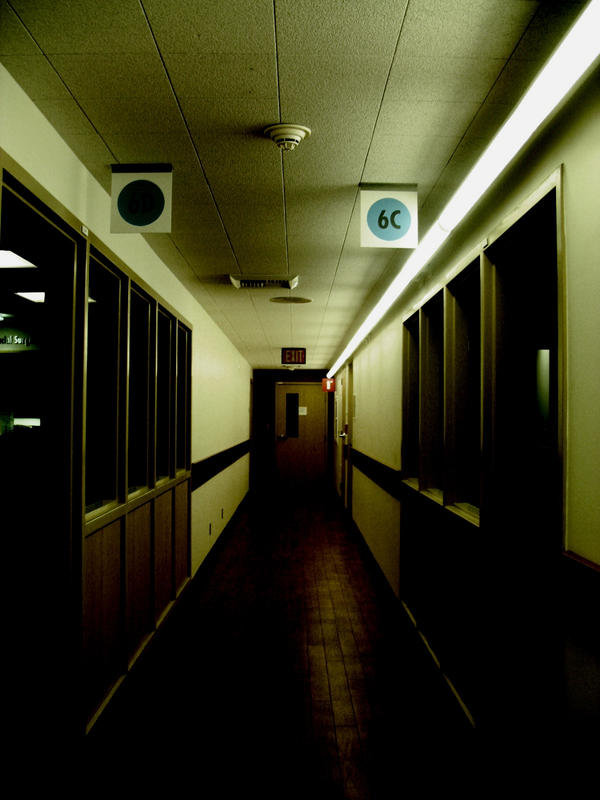
Locate an element on the screen. The image size is (600, 800). hallway is located at coordinates (287, 533).